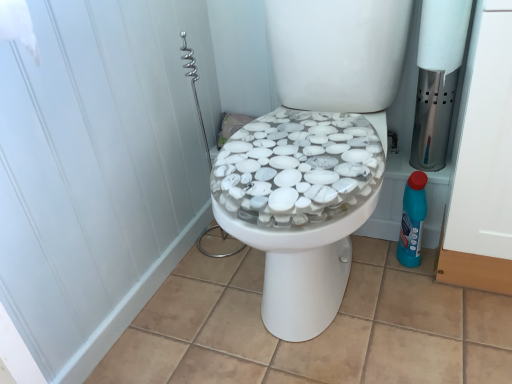
Question: From a real-world perspective, is white matte toilet paper at upper right positioned above or below white matte screen door at upper left?

Choices:
 (A) above
 (B) below

Answer: (A)

Question: From the image's perspective, is white matte toilet paper at upper right located above or below white matte screen door at upper left?

Choices:
 (A) below
 (B) above

Answer: (B)

Question: Estimate the real-world distances between objects in this image. Which object is farther from the white matte screen door at upper left?

Choices:
 (A) blue plastic bottle at right
 (B) white matte toilet paper at upper right

Answer: (B)

Question: Which is nearer to the white matte screen door at upper left?

Choices:
 (A) blue plastic bottle at right
 (B) white matte toilet paper at upper right

Answer: (A)